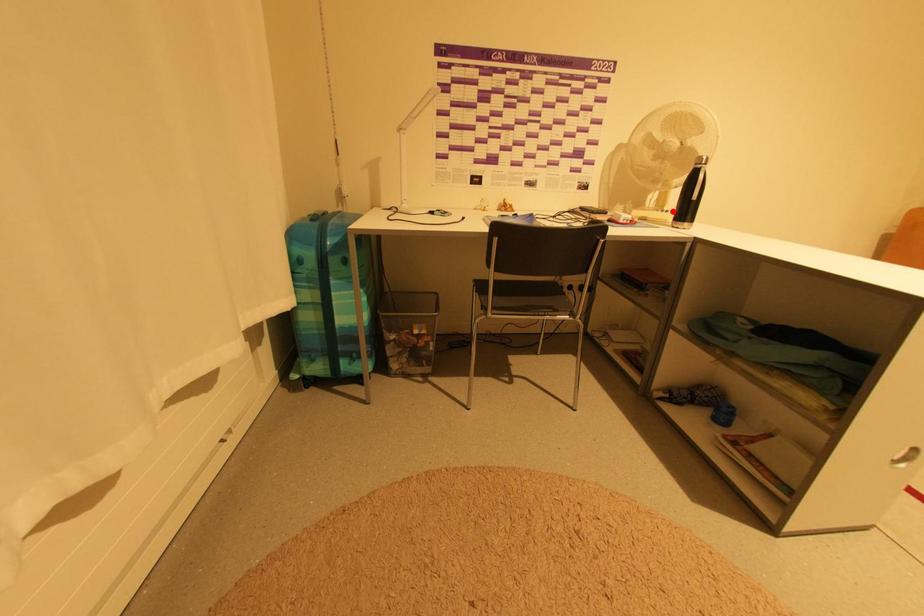
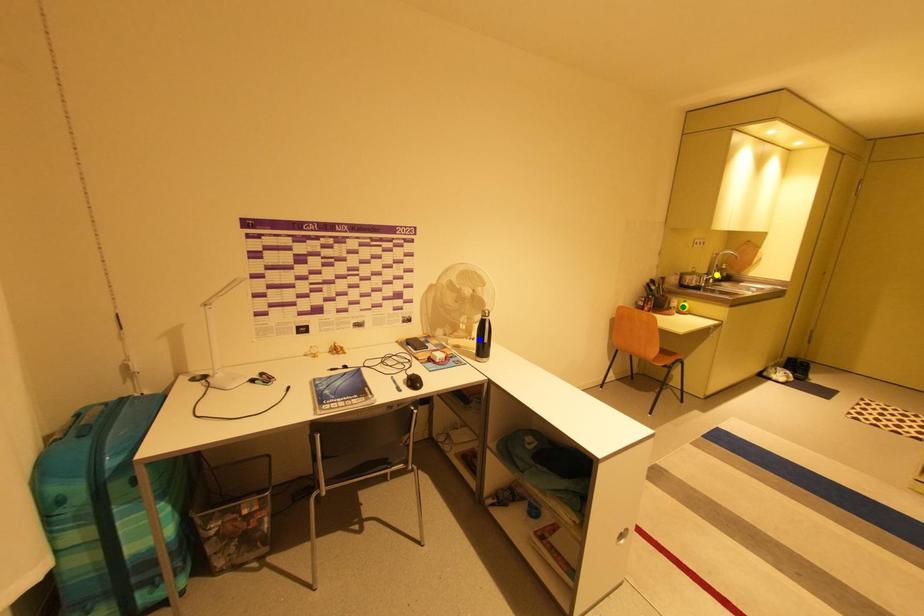
Question: I am providing you with two images of the same scene from different viewpoints. A red point is marked on the first image. You are given multiple points on the second image. Can you choose the point in image 2 that corresponds to the point in image 1?

Choices:
 (A) blue point
 (B) green point
 (C) yellow point

Answer: (A)